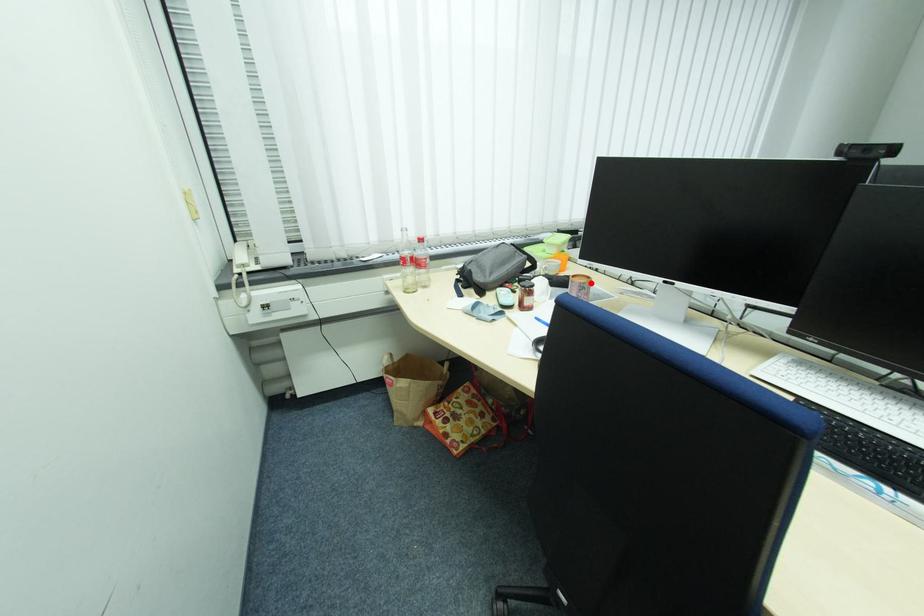
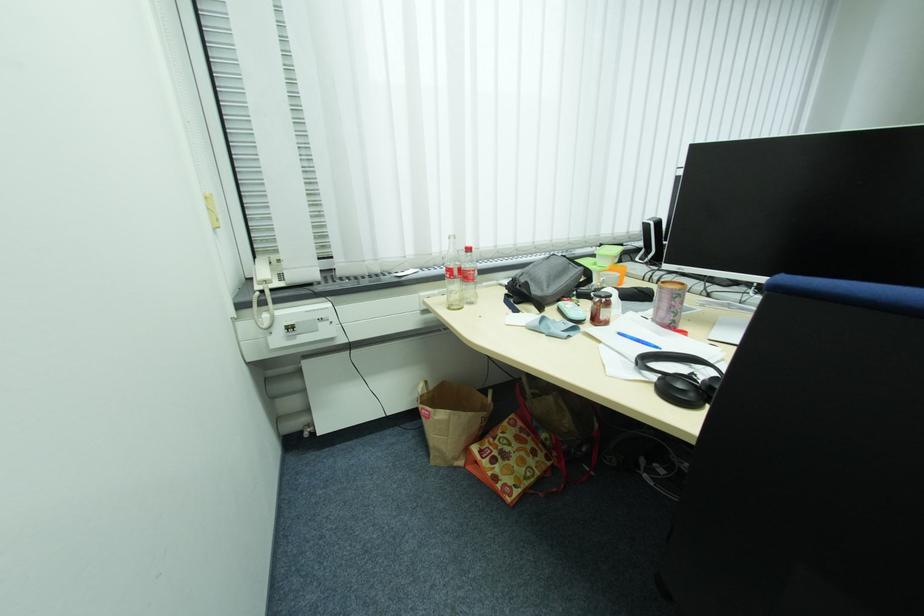
Where in the second image is the point corresponding to the highlighted location from the first image?

(687, 290)